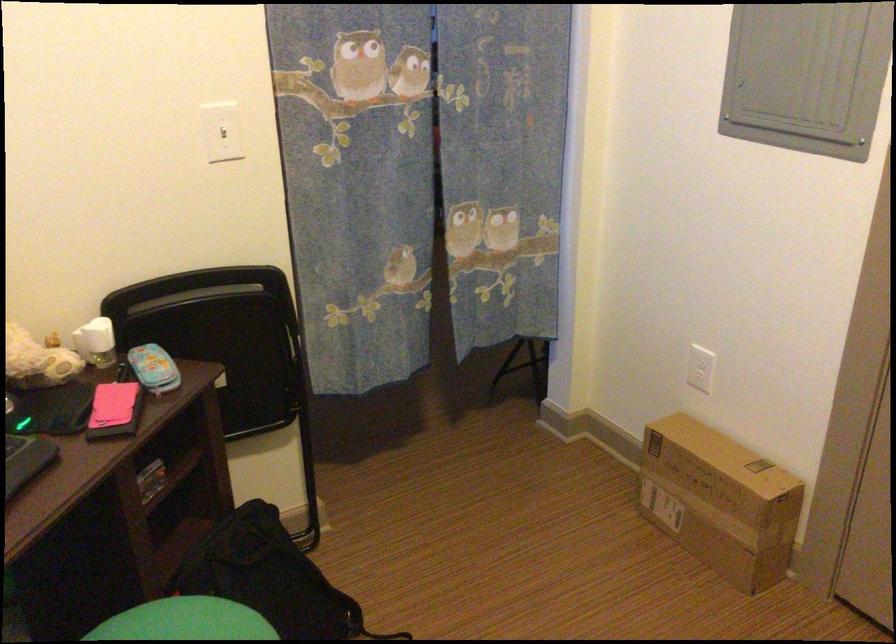
This screenshot has height=644, width=896. What do you see at coordinates (719, 500) in the screenshot?
I see `a brown cardboard box` at bounding box center [719, 500].